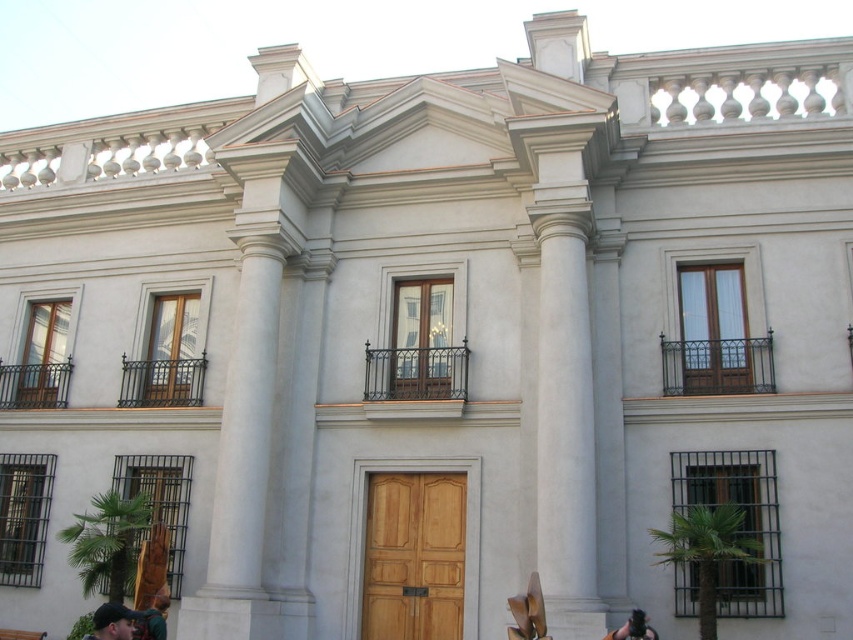
Is dark blue fabric cap at lower left above dark brown leather jacket at lower right?

Incorrect, dark blue fabric cap at lower left is not positioned above dark brown leather jacket at lower right.

Is dark blue fabric cap at lower left to the left of dark brown leather jacket at lower right from the viewer's perspective?

Indeed, dark blue fabric cap at lower left is positioned on the left side of dark brown leather jacket at lower right.

Does point (114, 632) lie behind point (630, 637)?

No, (114, 632) is closer to viewer.

You are a GUI agent. You are given a task and a screenshot of the screen. Output one action in this format:
    pyautogui.click(x=<x>, y=<y>)
    Task: Click on the dark blue fabric cap at lower left
    The width and height of the screenshot is (853, 640).
    Given the screenshot: What is the action you would take?
    pyautogui.click(x=112, y=621)

Can you confirm if green fabric shirt at lower left is positioned below dark brown leather jacket at lower right?

Yes, green fabric shirt at lower left is below dark brown leather jacket at lower right.

Who is positioned more to the right, green fabric shirt at lower left or dark brown leather jacket at lower right?

Positioned to the right is dark brown leather jacket at lower right.

The height and width of the screenshot is (640, 853). I want to click on green fabric shirt at lower left, so click(154, 618).

Which of these two, dark blue fabric cap at lower left or green fabric shirt at lower left, stands taller?

dark blue fabric cap at lower left is taller.

Does dark blue fabric cap at lower left appear on the right side of green fabric shirt at lower left?

No, dark blue fabric cap at lower left is not to the right of green fabric shirt at lower left.

Is point (96, 632) less distant than point (157, 611)?

Yes, point (96, 632) is in front of point (157, 611).

This screenshot has height=640, width=853. I want to click on dark blue fabric cap at lower left, so click(112, 621).